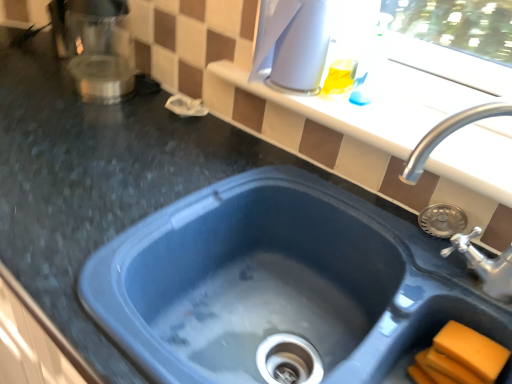
You are a GUI agent. You are given a task and a screenshot of the screen. Output one action in this format:
    pyautogui.click(x=<x>, y=<y>)
    Task: Click on the blank space to the left of satin silver coffee maker at upper left, which is the first appliance from left to right
    The width and height of the screenshot is (512, 384).
    Given the screenshot: What is the action you would take?
    pyautogui.click(x=25, y=92)